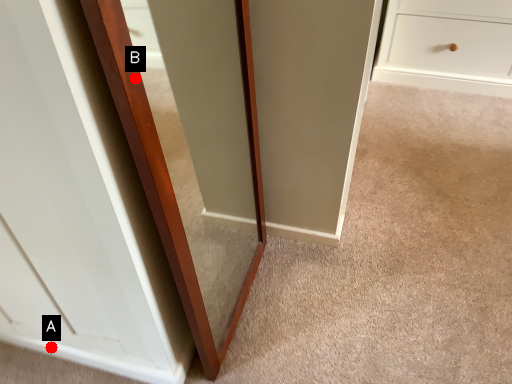
Question: Two points are circled on the image, labeled by A and B beside each circle. Which point is farther to the camera?

Choices:
 (A) A is further
 (B) B is further

Answer: (A)